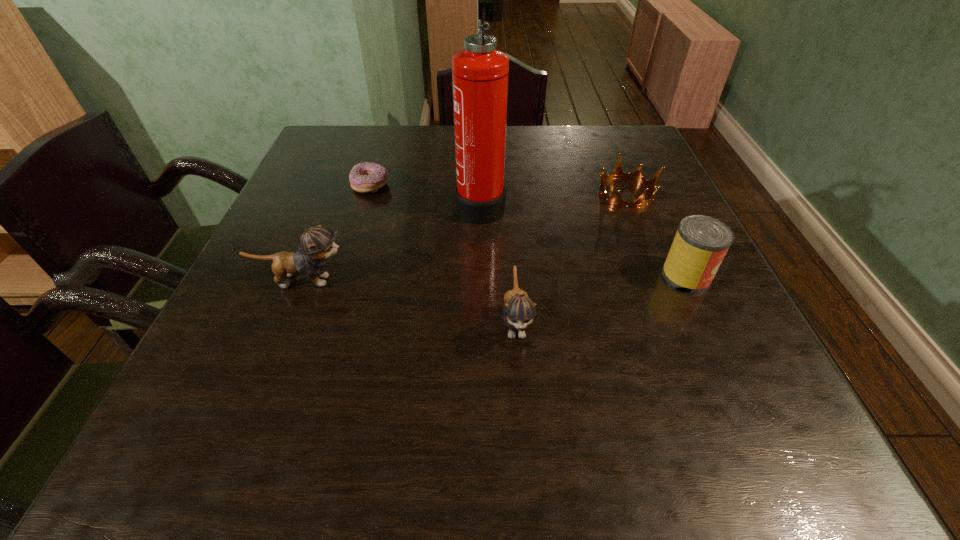
The image size is (960, 540). Find the location of `free location at the left edge of the desktop`. free location at the left edge of the desktop is located at coordinates (268, 276).

Locate an element on the screen. This screenshot has height=540, width=960. vacant region at the right edge is located at coordinates (634, 198).

The width and height of the screenshot is (960, 540). Identify the location of vacant area at the far left corner of the desktop. (324, 167).

Locate an element on the screen. This screenshot has width=960, height=540. unoccupied position between the can and the crown is located at coordinates (657, 234).

You are a GUI agent. You are given a task and a screenshot of the screen. Output one action in this format:
    pyautogui.click(x=<x>, y=<y>)
    Task: Click on the free space between the tallest object and the second shortest object
    
    Given the screenshot: What is the action you would take?
    pyautogui.click(x=553, y=198)

The width and height of the screenshot is (960, 540). I want to click on vacant space in between the can and the crown, so click(x=657, y=234).

The width and height of the screenshot is (960, 540). I want to click on free area in between the left kitten and the shorter kitten, so click(409, 301).

Identify the location of free space between the second shortest object and the tallest object. (553, 198).

Locate an element on the screen. unoccupied position between the doughnut and the shorter kitten is located at coordinates (444, 253).

Find the location of a particular element. Image resolution: width=960 pixels, height=540 pixels. vacant point located between the tallest object and the shorter kitten is located at coordinates (498, 262).